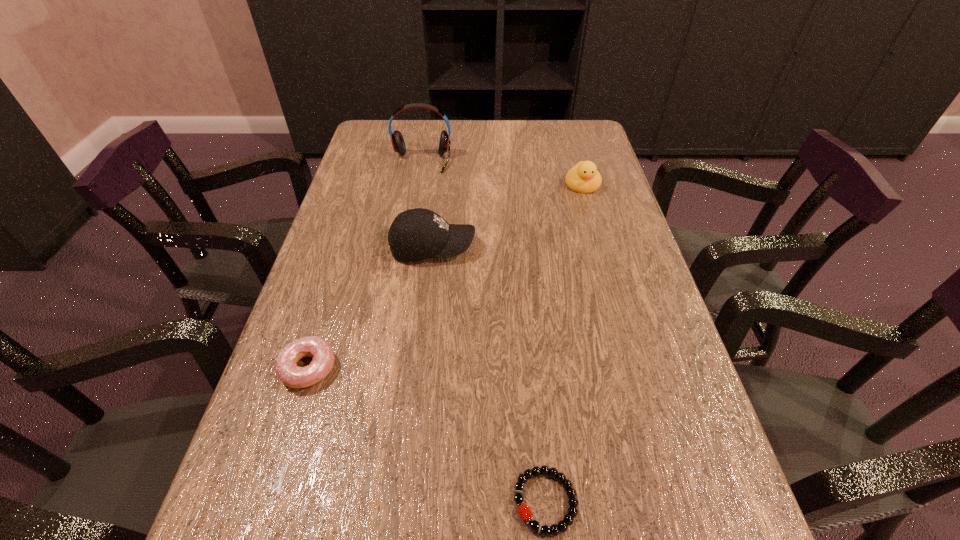
The width and height of the screenshot is (960, 540). Find the location of `vacant space located with the microphone attached to the side of the tallest object`. vacant space located with the microphone attached to the side of the tallest object is located at coordinates (409, 235).

Identify the location of free space located on the front-facing side of the third nearest object. (512, 247).

This screenshot has width=960, height=540. What are the coordinates of `free location located 0.360m on the face of the duckling` in the screenshot? It's located at (612, 292).

The image size is (960, 540). Find the location of `free spot located on the back of the second shortest object`. free spot located on the back of the second shortest object is located at coordinates (334, 286).

I want to click on vacant region located 0.070m on the right of the bracelet, so click(x=623, y=501).

This screenshot has width=960, height=540. In order to click on object located in the far edge section of the desktop in this screenshot , I will do `click(397, 140)`.

Find the location of a particular element. The image size is (960, 540). headset present at the left edge is located at coordinates (397, 140).

Locate an element on the screen. Image resolution: width=960 pixels, height=540 pixels. doughnut that is at the left edge is located at coordinates (293, 376).

What are the coordinates of `object that is at the right edge` in the screenshot? It's located at (584, 178).

This screenshot has width=960, height=540. Find the location of `object present at the far left corner`. object present at the far left corner is located at coordinates (397, 140).